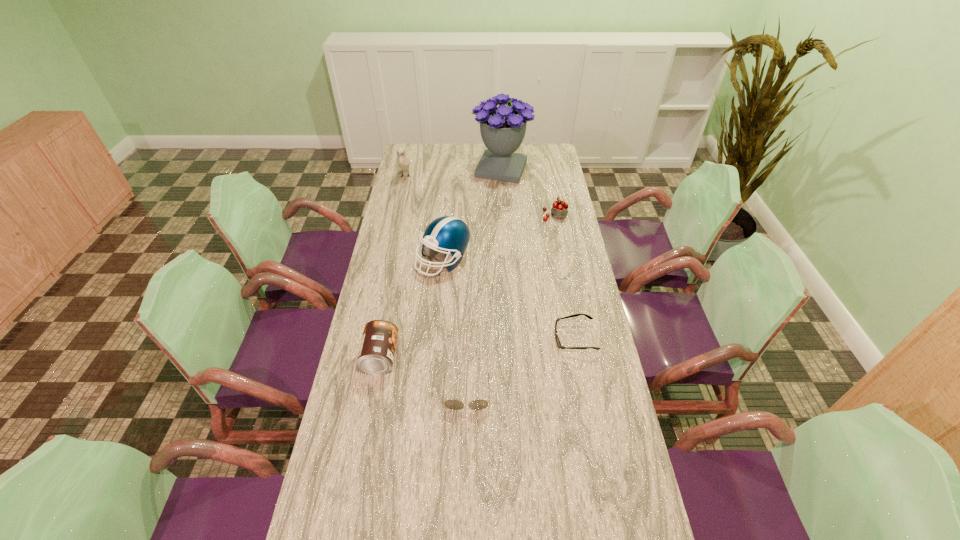
The image size is (960, 540). I want to click on bouquet positioned at the far edge, so click(x=503, y=128).

At what (x,y) coordinates should I click in order to perform the action: click on bird that is at the far edge. Please return your answer as a coordinate pair (x, y). Image resolution: width=960 pixels, height=540 pixels. Looking at the image, I should click on (403, 162).

Identify the location of football helmet present at the left edge. (451, 235).

This screenshot has width=960, height=540. Find the location of `bird at the left edge`. bird at the left edge is located at coordinates (403, 162).

Identify the location of can situated at the left edge. (376, 353).

The image size is (960, 540). Find the location of `bouquet at the right edge`. bouquet at the right edge is located at coordinates (503, 128).

The image size is (960, 540). Identify the location of cherry that is at the right edge. (559, 210).

Identify the location of sunglasses that is positioned at the right edge. (558, 342).

At what (x,y) coordinates should I click in order to perform the action: click on object at the far left corner. Please return your answer as a coordinate pair (x, y). Looking at the image, I should click on pyautogui.click(x=403, y=162).

Locate an element on the screen. This screenshot has height=540, width=960. object located in the far right corner section of the desktop is located at coordinates tap(503, 128).